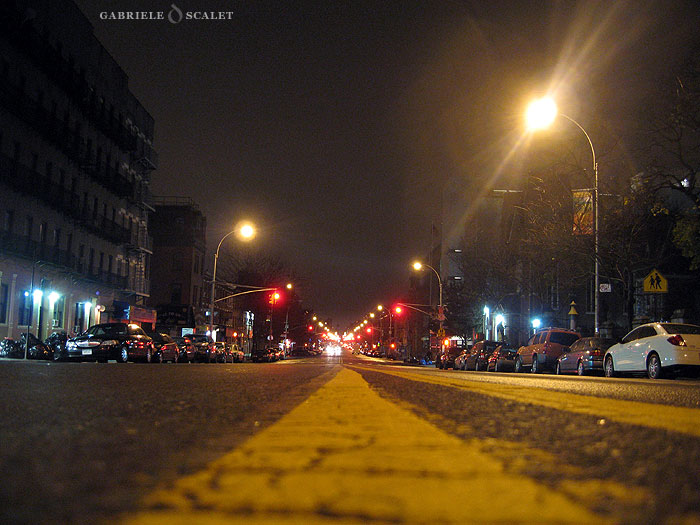
In order to click on lights in this screenshot , I will do `click(540, 320)`, `click(498, 315)`, `click(486, 309)`, `click(52, 295)`, `click(35, 297)`, `click(88, 304)`, `click(182, 325)`, `click(246, 315)`, `click(682, 184)`.